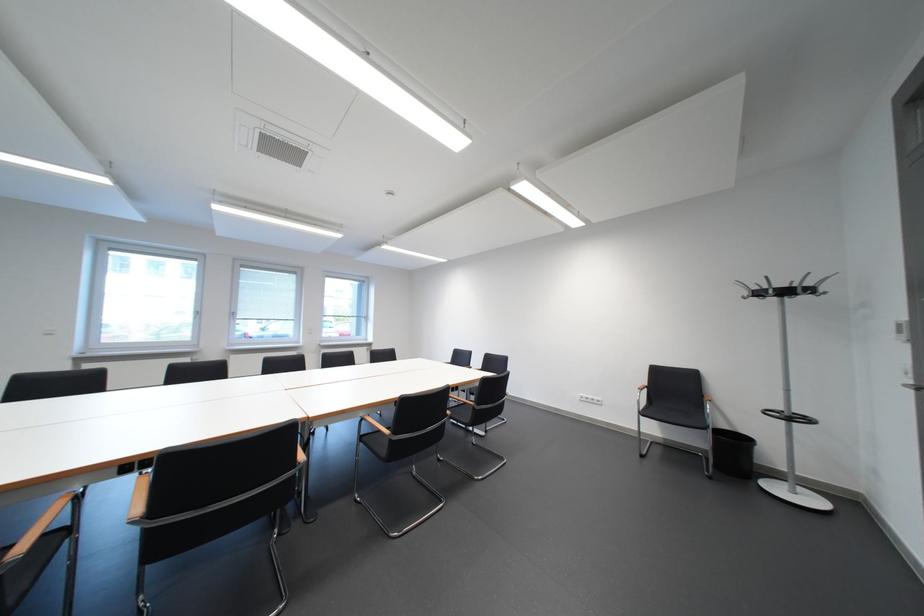
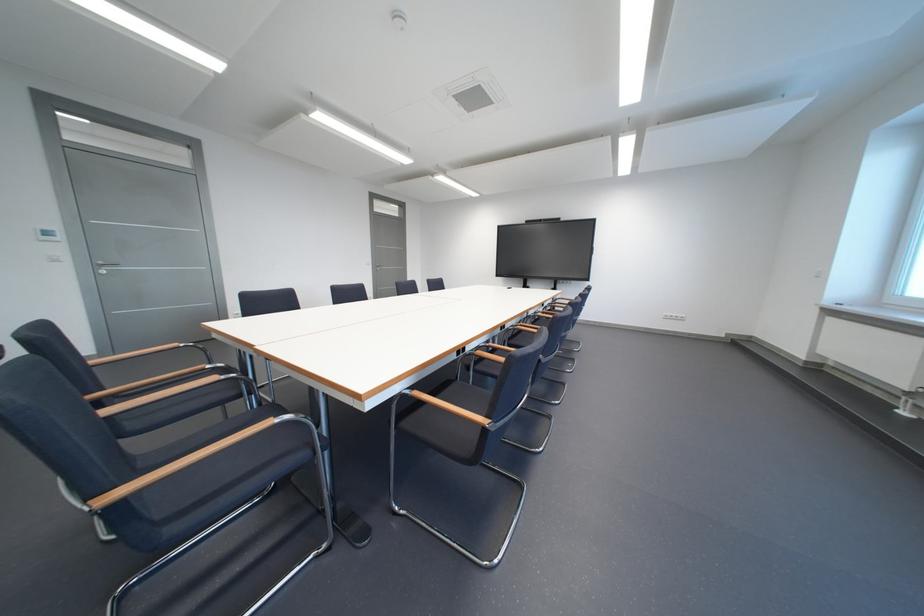
Question: I am providing you with two images of the same scene from different viewpoints. Please identify which objects are invisible in image2.

Choices:
 (A) silver door handle
 (B) black chair sitting surface
 (C) chair sitting surface
 (D) paper towel holder knob

Answer: (B)